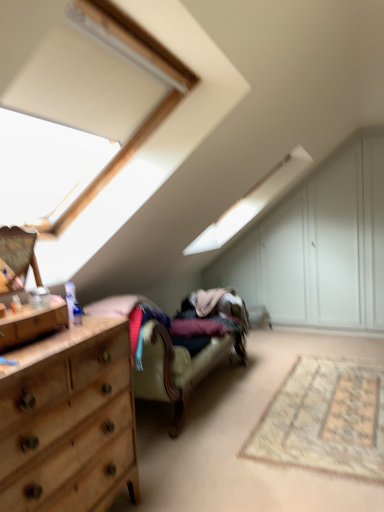
Question: Considering the relative sizes of velvet beige couch at center and wooden dresser at left in the image provided, is velvet beige couch at center bigger than wooden dresser at left?

Choices:
 (A) yes
 (B) no

Answer: (A)

Question: From a real-world perspective, is velvet beige couch at center physically below wooden dresser at left?

Choices:
 (A) yes
 (B) no

Answer: (A)

Question: Can you confirm if velvet beige couch at center is positioned to the left of wooden dresser at left?

Choices:
 (A) yes
 (B) no

Answer: (B)

Question: Is velvet beige couch at center thinner than wooden dresser at left?

Choices:
 (A) no
 (B) yes

Answer: (A)

Question: From the image's perspective, is velvet beige couch at center above wooden dresser at left?

Choices:
 (A) yes
 (B) no

Answer: (A)

Question: Choose the correct answer: Is beige woven rug at lower right inside wooden dresser at left or outside it?

Choices:
 (A) inside
 (B) outside

Answer: (B)

Question: From a real-world perspective, is beige woven rug at lower right positioned above or below wooden dresser at left?

Choices:
 (A) above
 (B) below

Answer: (B)

Question: Is beige woven rug at lower right to the left or to the right of wooden dresser at left in the image?

Choices:
 (A) right
 (B) left

Answer: (A)

Question: Is point (377, 428) positioned closer to the camera than point (81, 438)?

Choices:
 (A) closer
 (B) farther

Answer: (B)

Question: Is velvet beige couch at center wider or thinner than wooden dresser at left?

Choices:
 (A) thin
 (B) wide

Answer: (B)

Question: Considering their positions, is velvet beige couch at center located in front of or behind wooden dresser at left?

Choices:
 (A) behind
 (B) front

Answer: (A)

Question: Is point (165, 331) closer or farther from the camera than point (26, 257)?

Choices:
 (A) farther
 (B) closer

Answer: (B)

Question: Would you say velvet beige couch at center is inside or outside wooden dresser at left?

Choices:
 (A) inside
 (B) outside

Answer: (B)

Question: Is velvet beige couch at center situated inside beige woven rug at lower right or outside?

Choices:
 (A) outside
 (B) inside

Answer: (A)

Question: Is point (119, 309) positioned closer to the camera than point (302, 367)?

Choices:
 (A) farther
 (B) closer

Answer: (B)